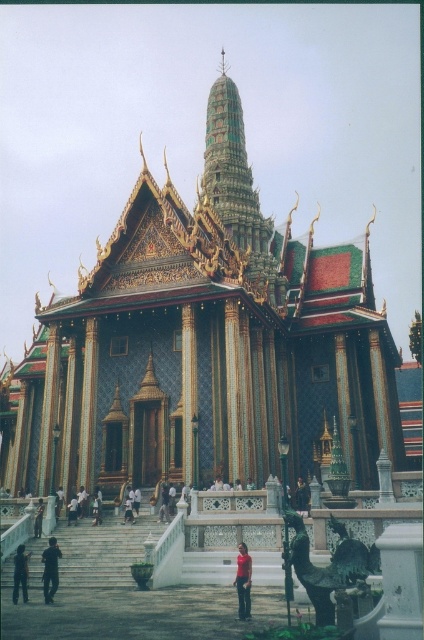
Question: Which point is farther to the camera?

Choices:
 (A) (69, 524)
 (B) (164, 484)
 (C) (306, 499)

Answer: (C)

Question: Is dark gray fabric pants at lower left closer to the viewer compared to dark blue fabric at center?

Choices:
 (A) no
 (B) yes

Answer: (B)

Question: Can you confirm if dark brown leather jacket at center is bigger than light brown wooden person at center?

Choices:
 (A) yes
 (B) no

Answer: (A)

Question: Is dark blue jeans at lower left wider than dark blue fabric person at lower left?

Choices:
 (A) yes
 (B) no

Answer: (B)

Question: Among these points, which one is nearest to the camera?

Choices:
 (A) click(166, 497)
 (B) click(131, 516)
 (C) click(50, 570)
 (D) click(39, 520)

Answer: (C)

Question: Which point is closer to the camera?

Choices:
 (A) dark brown leather jacket at center
 (B) dark blue jeans at lower left
 (C) light brown wooden person at center

Answer: (B)